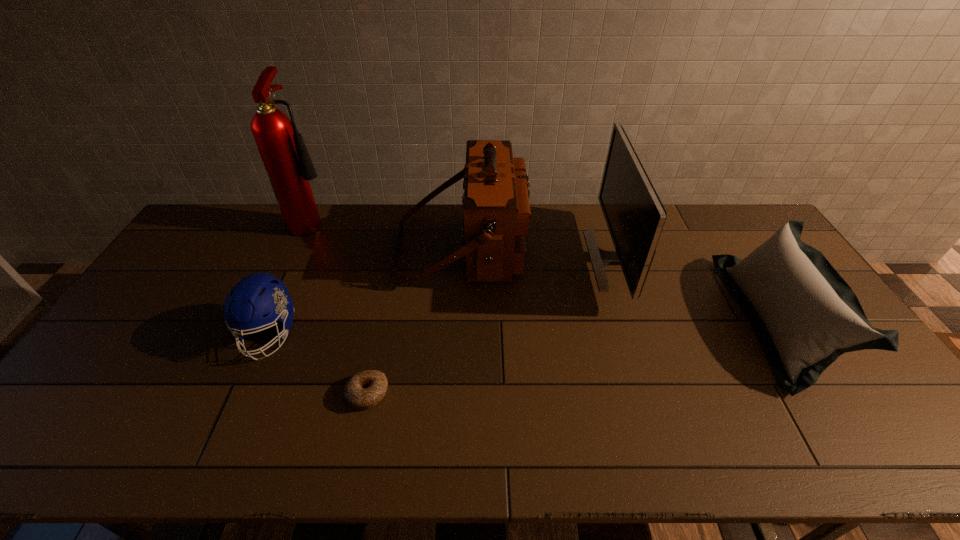
Where is `vacant point located between the monitor and the satchel`? Image resolution: width=960 pixels, height=540 pixels. vacant point located between the monitor and the satchel is located at coordinates (539, 253).

You are a GUI agent. You are given a task and a screenshot of the screen. Output one action in this format:
    pyautogui.click(x=<x>, y=<y>)
    Task: Click on the empty location between the football helmet and the fire extinguisher
    
    Given the screenshot: What is the action you would take?
    pyautogui.click(x=292, y=277)

I want to click on free space that is in between the satchel and the monitor, so click(x=539, y=253).

At what (x,y) coordinates should I click in order to perform the action: click on blank region between the shortest object and the tallest object. Please return your answer as a coordinate pair (x, y). Looking at the image, I should click on (341, 307).

Identify which object is the third closest to the cushion. Please provide its 2D coordinates. Your answer should be formatted as a tuple, i.e. [(x, y)], where the tuple contains the x and y coordinates of a point satisfying the conditions above.

[(365, 389)]

Identify which object is the nearest to the cushion. Please provide its 2D coordinates. Your answer should be formatted as a tuple, i.e. [(x, y)], where the tuple contains the x and y coordinates of a point satisfying the conditions above.

[(635, 216)]

Identify the location of free spot that satisfies the following two spatial constraints: 1. on the surface of the cushion; 2. on the face guard of the football helmet. (785, 334).

Locate an element on the screen. The image size is (960, 540). free space that satisfies the following two spatial constraints: 1. on the face side of the satchel; 2. on the face guard of the football helmet is located at coordinates (458, 334).

You are a GUI agent. You are given a task and a screenshot of the screen. Output one action in this format:
    pyautogui.click(x=<x>, y=<y>)
    Task: Click on the vacant space that satisfies the following two spatial constraints: 1. at the nozzle of the fire extinguisher; 2. on the back side of the doughnut
    
    Given the screenshot: What is the action you would take?
    pyautogui.click(x=236, y=393)

You are a GUI agent. You are given a task and a screenshot of the screen. Output one action in this format:
    pyautogui.click(x=<x>, y=<y>)
    Task: Click on the vacant region that satisfies the following two spatial constraints: 1. at the nozzle of the doughnut; 2. on the right side of the fire extinguisher
    
    Given the screenshot: What is the action you would take?
    pyautogui.click(x=236, y=393)